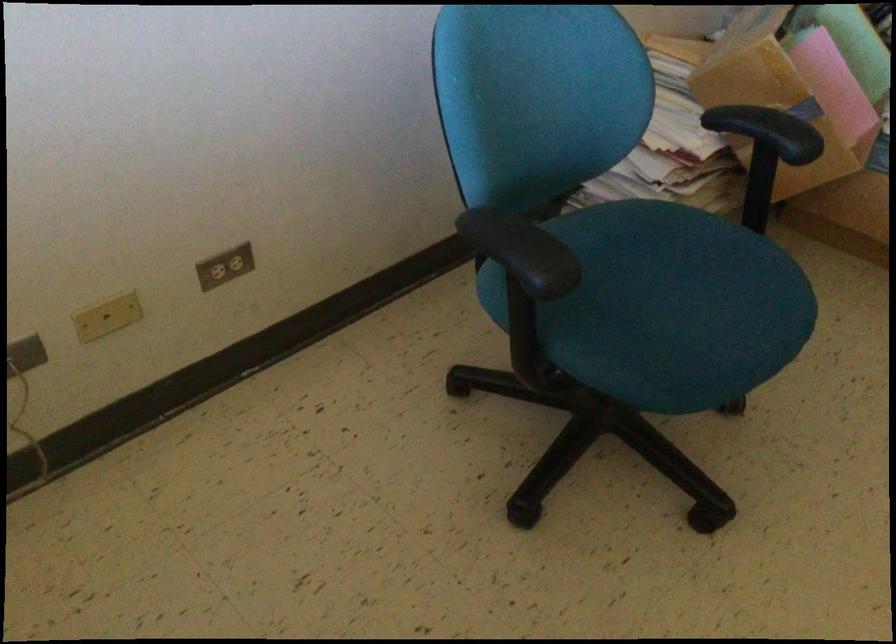
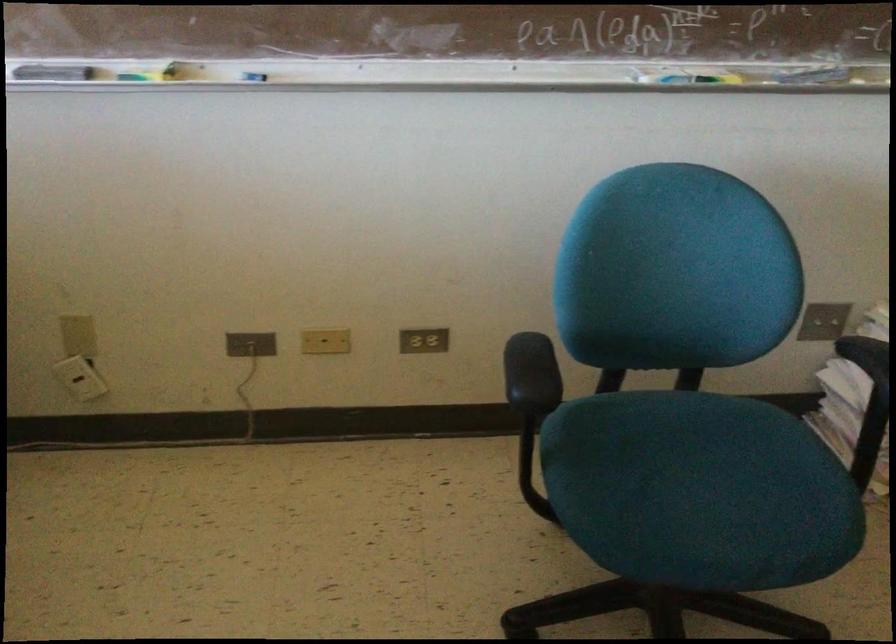
Find the pixel in the second image that matches the point at 236,269 in the first image.

(423, 341)